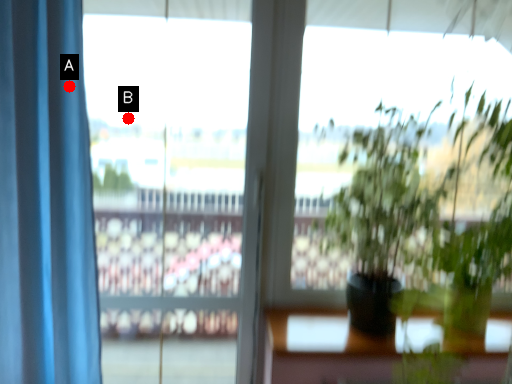
Question: Two points are circled on the image, labeled by A and B beside each circle. Which point is closer to the camera?

Choices:
 (A) A is closer
 (B) B is closer

Answer: (A)